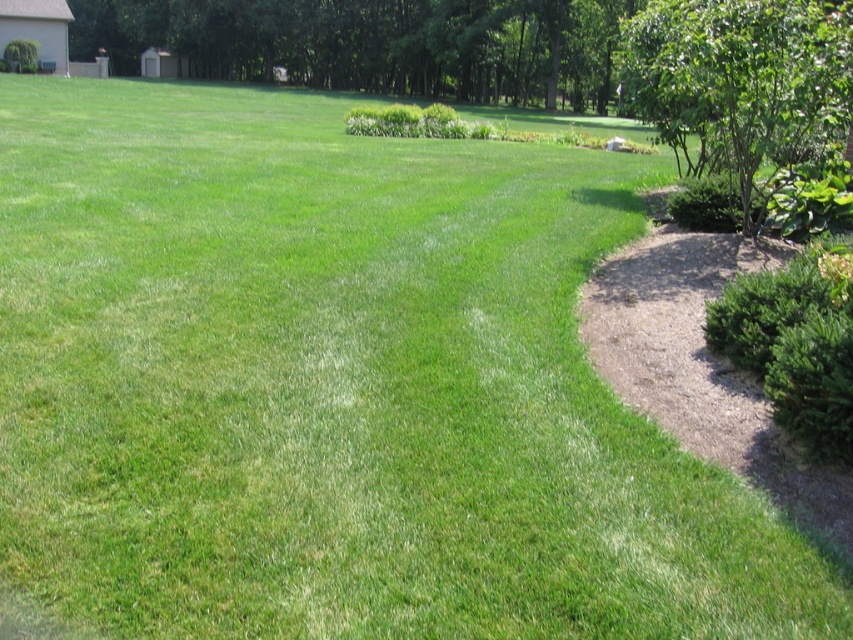
Question: Does green leafy tree at upper center come in front of green textured bush at right?

Choices:
 (A) yes
 (B) no

Answer: (B)

Question: Which point is farther from the camera taking this photo?

Choices:
 (A) (686, 10)
 (B) (20, 49)
 (C) (424, 136)
 (D) (676, 200)

Answer: (B)

Question: Does green leafy tree at upper center have a larger size compared to green leafy bush at center?

Choices:
 (A) no
 (B) yes

Answer: (B)

Question: Which object appears farthest from the camera in this image?

Choices:
 (A) green leafy bush at upper left
 (B) green leafy bush at right

Answer: (A)

Question: Can you confirm if green textured bush at right is wider than green leafy bush at upper left?

Choices:
 (A) yes
 (B) no

Answer: (B)

Question: Which object appears farthest from the camera in this image?

Choices:
 (A) green textured bush at right
 (B) green leafy tree at upper right
 (C) green leafy bush at upper left
 (D) green leafy tree at upper center

Answer: (C)